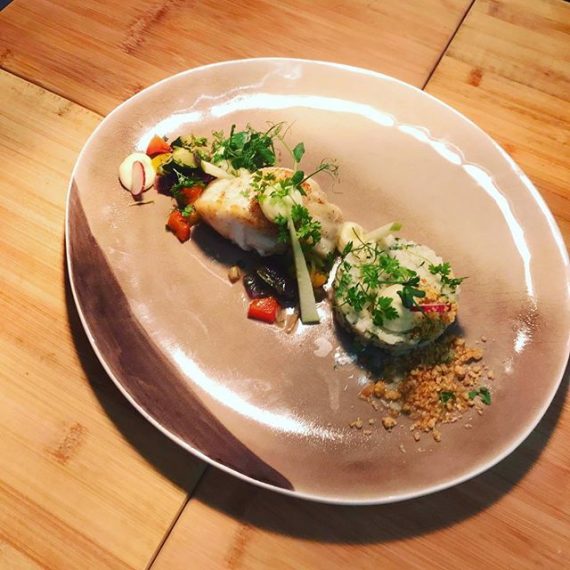
I want to click on plate, so click(205, 399).